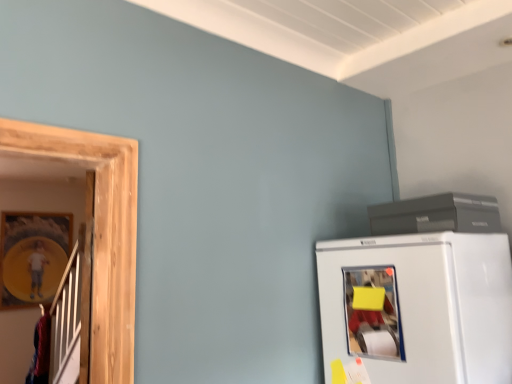
Question: Is matte gray printer at upper right positioned far away from yellow matte paper at lower right?

Choices:
 (A) no
 (B) yes

Answer: (A)

Question: Is matte gray printer at upper right behind yellow matte paper at lower right?

Choices:
 (A) yes
 (B) no

Answer: (A)

Question: Is matte gray printer at upper right outside yellow matte paper at lower right?

Choices:
 (A) no
 (B) yes

Answer: (B)

Question: From the image's perspective, does matte gray printer at upper right appear higher than yellow matte paper at lower right?

Choices:
 (A) yes
 (B) no

Answer: (A)

Question: From a real-world perspective, is matte gray printer at upper right over yellow matte paper at lower right?

Choices:
 (A) yes
 (B) no

Answer: (A)

Question: Does matte gray printer at upper right touch yellow matte paper at lower right?

Choices:
 (A) yes
 (B) no

Answer: (B)

Question: Are yellow matte paper at lower right and matte gray printer at upper right far apart?

Choices:
 (A) no
 (B) yes

Answer: (A)

Question: Is yellow matte paper at lower right surrounding matte gray printer at upper right?

Choices:
 (A) yes
 (B) no

Answer: (B)

Question: Is yellow matte paper at lower right wider than matte gray printer at upper right?

Choices:
 (A) no
 (B) yes

Answer: (A)

Question: From a real-world perspective, does yellow matte paper at lower right sit lower than matte gray printer at upper right?

Choices:
 (A) yes
 (B) no

Answer: (A)

Question: Is yellow matte paper at lower right facing away from matte gray printer at upper right?

Choices:
 (A) no
 (B) yes

Answer: (A)

Question: Considering the relative positions of yellow matte paper at lower right and matte gray printer at upper right in the image provided, is yellow matte paper at lower right to the left of matte gray printer at upper right from the viewer's perspective?

Choices:
 (A) no
 (B) yes

Answer: (B)

Question: Is white matte refrigerator at lower right smaller than yellow matte paper at lower right?

Choices:
 (A) yes
 (B) no

Answer: (B)